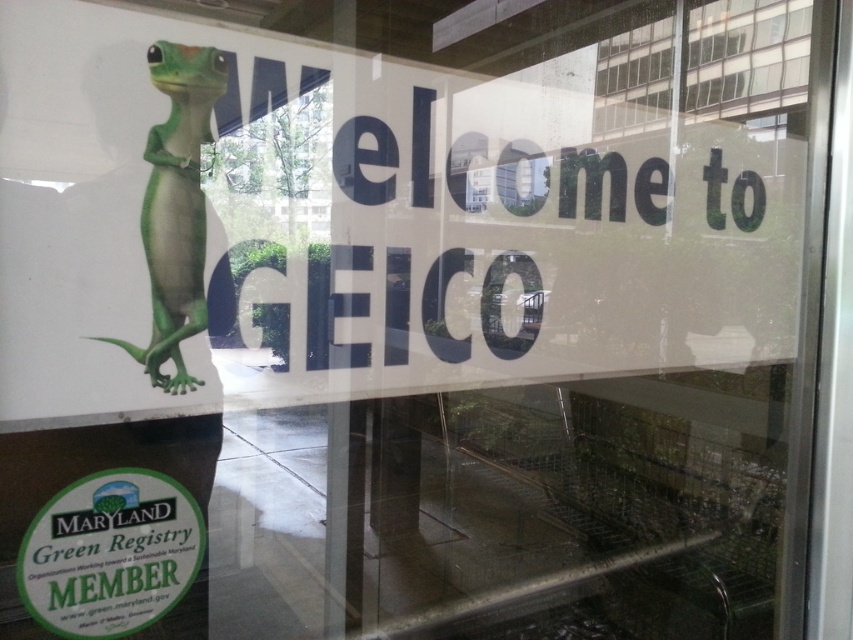
Does transparent glass window at upper center lie behind green matte lizard at upper left?

Yes.

Is the position of transparent glass window at upper center less distant than that of green matte lizard at upper left?

That is False.

Does point (772, 51) come farther from viewer compared to point (187, 93)?

Yes.

This screenshot has height=640, width=853. I want to click on transparent glass window at upper center, so click(703, 65).